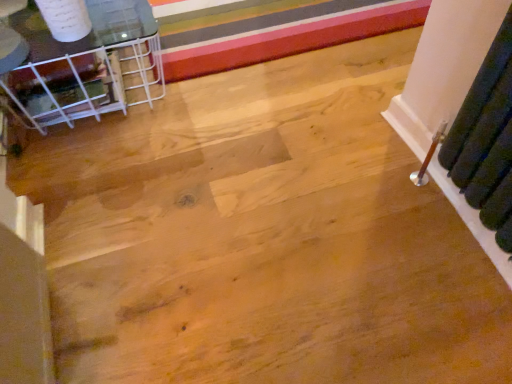
This screenshot has height=384, width=512. Describe the element at coordinates (279, 33) in the screenshot. I see `multicolored striped carpet at upper center` at that location.

Find the location of `multicolored striped carpet at upper center`. multicolored striped carpet at upper center is located at coordinates (279, 33).

In order to face clear glass table at upper left, should I rotate leftwards or rightwards?

You should look left and rotate roughly 21.058 degrees.

Find the location of `clear glass table at upper left`. clear glass table at upper left is located at coordinates coord(86,65).

What do you see at coordinates (86, 65) in the screenshot? The image size is (512, 384). I see `clear glass table at upper left` at bounding box center [86, 65].

You are a GUI agent. You are given a task and a screenshot of the screen. Output one action in this format:
    pyautogui.click(x=<x>, y=<y>)
    Task: Click on the multicolored striped carpet at upper center
    The width and height of the screenshot is (512, 384).
    Given the screenshot: What is the action you would take?
    pyautogui.click(x=279, y=33)

Which is more to the right, clear glass table at upper left or multicolored striped carpet at upper center?

multicolored striped carpet at upper center.

Considering the positions of objects clear glass table at upper left and multicolored striped carpet at upper center in the image provided, who is behind, clear glass table at upper left or multicolored striped carpet at upper center?

multicolored striped carpet at upper center is further away from the camera.

Is point (161, 63) closer to viewer compared to point (211, 22)?

Yes, it is.

From the image's perspective, which is above, clear glass table at upper left or multicolored striped carpet at upper center?

multicolored striped carpet at upper center.

From a real-world perspective, is clear glass table at upper left positioned above or below multicolored striped carpet at upper center?

clear glass table at upper left is situated higher than multicolored striped carpet at upper center in the real world.

Based on the photo, which of these two, clear glass table at upper left or multicolored striped carpet at upper center, is thinner?

With smaller width is clear glass table at upper left.

Between clear glass table at upper left and multicolored striped carpet at upper center, which one has more height?

clear glass table at upper left is taller.

Considering the sizes of objects clear glass table at upper left and multicolored striped carpet at upper center in the image provided, who is bigger, clear glass table at upper left or multicolored striped carpet at upper center?

clear glass table at upper left is bigger.

Is clear glass table at upper left positioned beyond the bounds of multicolored striped carpet at upper center?

Yes, clear glass table at upper left is located beyond the bounds of multicolored striped carpet at upper center.

Based on the photo, is clear glass table at upper left with multicolored striped carpet at upper center?

There is a gap between clear glass table at upper left and multicolored striped carpet at upper center.

Is clear glass table at upper left aimed at multicolored striped carpet at upper center?

Yes, clear glass table at upper left faces towards multicolored striped carpet at upper center.

Measure the distance between clear glass table at upper left and multicolored striped carpet at upper center.

The distance of clear glass table at upper left from multicolored striped carpet at upper center is 13.99 inches.

Locate an element on the screen. The height and width of the screenshot is (384, 512). stripe behind the clear glass table at upper left is located at coordinates (279, 33).

Would you say multicolored striped carpet at upper center is to the left or to the right of clear glass table at upper left in the picture?

In the image, multicolored striped carpet at upper center appears on the right side of clear glass table at upper left.

Between multicolored striped carpet at upper center and clear glass table at upper left, which one is positioned in front?

clear glass table at upper left is in front.

Is point (292, 15) farther from viewer compared to point (34, 19)?

That is True.

From the image's perspective, between multicolored striped carpet at upper center and clear glass table at upper left, which one is located above?

multicolored striped carpet at upper center.

From a real-world perspective, which object rests below the other?

In real-world perspective, multicolored striped carpet at upper center is lower.

Considering the relative sizes of multicolored striped carpet at upper center and clear glass table at upper left in the image provided, is multicolored striped carpet at upper center thinner than clear glass table at upper left?

No, multicolored striped carpet at upper center is not thinner than clear glass table at upper left.

Can you confirm if multicolored striped carpet at upper center is shorter than clear glass table at upper left?

Correct, multicolored striped carpet at upper center is not as tall as clear glass table at upper left.

Looking at this image, considering the sizes of objects multicolored striped carpet at upper center and clear glass table at upper left in the image provided, who is smaller, multicolored striped carpet at upper center or clear glass table at upper left?

multicolored striped carpet at upper center.

Is multicolored striped carpet at upper center situated inside clear glass table at upper left or outside?

multicolored striped carpet at upper center is located beyond the bounds of clear glass table at upper left.

Are multicolored striped carpet at upper center and clear glass table at upper left beside each other?

No, multicolored striped carpet at upper center is not in contact with clear glass table at upper left.

Is clear glass table at upper left at the back of multicolored striped carpet at upper center?

Yes, multicolored striped carpet at upper center is facing away from clear glass table at upper left.

How different are the orientations of multicolored striped carpet at upper center and clear glass table at upper left in degrees?

They differ by 0.197 degrees in their facing directions.

Identify the location of furniture above the multicolored striped carpet at upper center (from a real-world perspective). The height and width of the screenshot is (384, 512). (86, 65).

Where is `furniture that appears in front of the multicolored striped carpet at upper center`? The image size is (512, 384). furniture that appears in front of the multicolored striped carpet at upper center is located at coordinates (86, 65).

You are a GUI agent. You are given a task and a screenshot of the screen. Output one action in this format:
    pyautogui.click(x=<x>, y=<y>)
    Task: Click on the stripe that is above the clear glass table at upper left (from the image's perspective)
    
    Given the screenshot: What is the action you would take?
    pyautogui.click(x=279, y=33)